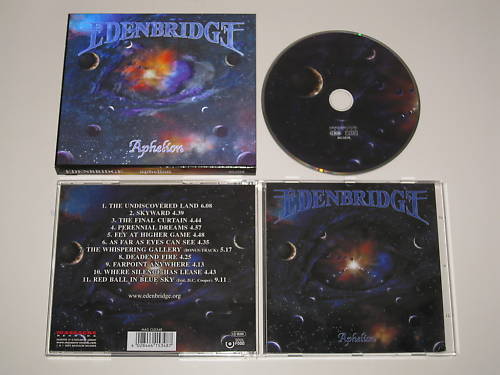
Image resolution: width=500 pixels, height=375 pixels. I want to click on cd, so click(x=372, y=117).